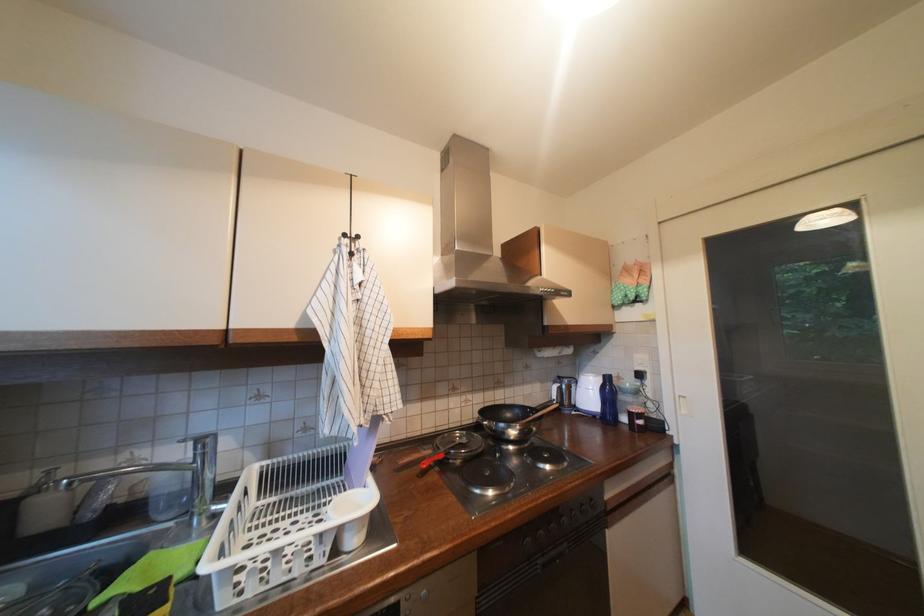
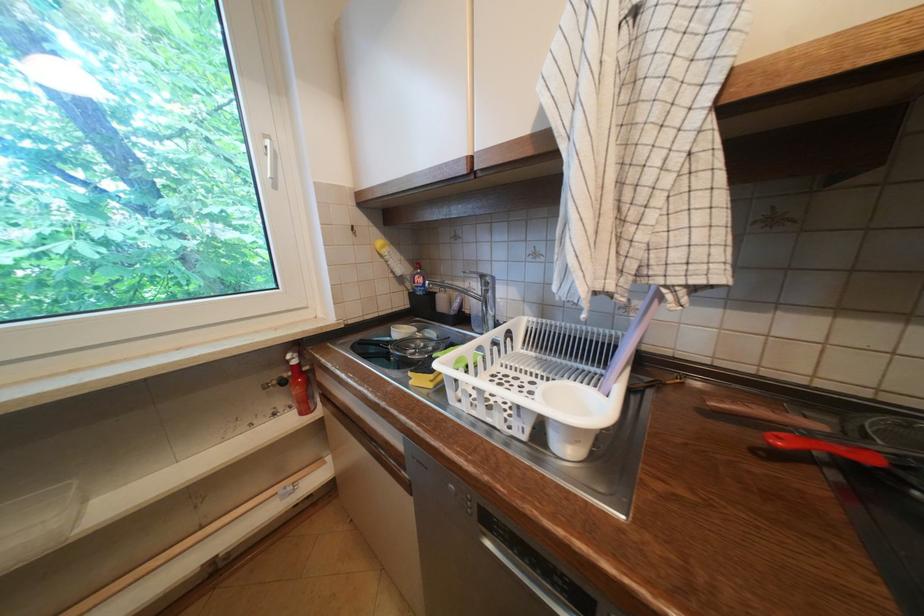
Where in the second image is the point corresponding to pixel 450 458 from the first image?

(881, 462)